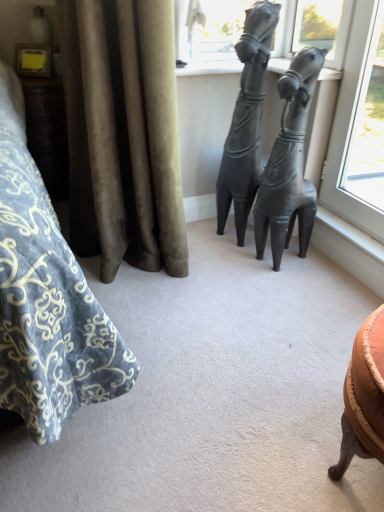
This screenshot has height=512, width=384. I want to click on free space that is to the left of matte black statue at center, the first statue (sculpture) in the left-to-right sequence, so click(x=201, y=237).